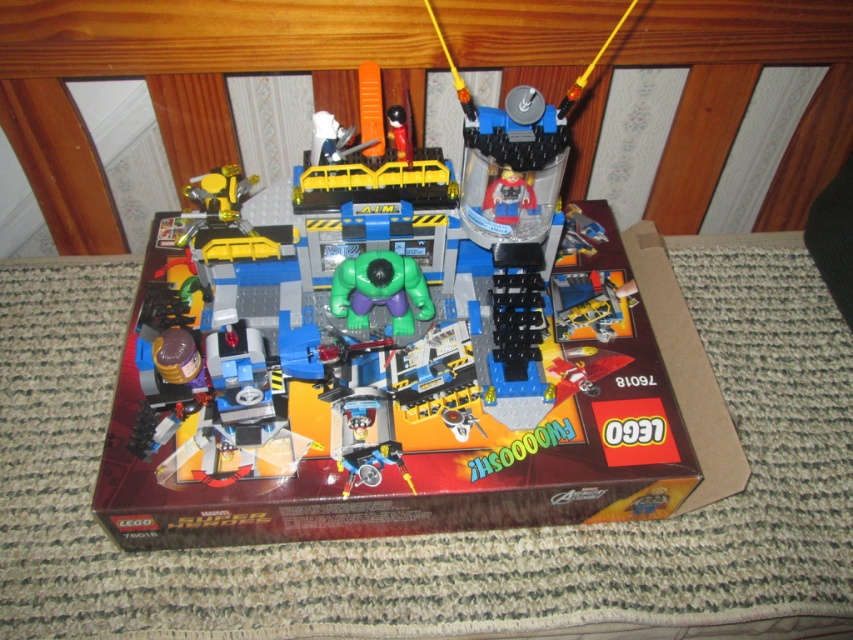
Which of these two, brown cardboard box at center or green rubber toy at center, stands shorter?

With less height is green rubber toy at center.

Is brown cardboard box at center to the left of green rubber toy at center from the viewer's perspective?

No, brown cardboard box at center is not to the left of green rubber toy at center.

The width and height of the screenshot is (853, 640). I want to click on brown cardboard box at center, so click(x=409, y=394).

What are the coordinates of `brown cardboard box at center` in the screenshot? It's located at (409, 394).